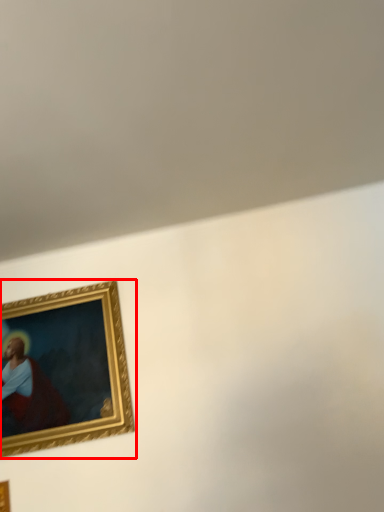
Question: From the image's perspective, what is the correct spatial relationship of picture frame (annotated by the red box) in relation to picture frame?

Choices:
 (A) above
 (B) below

Answer: (A)